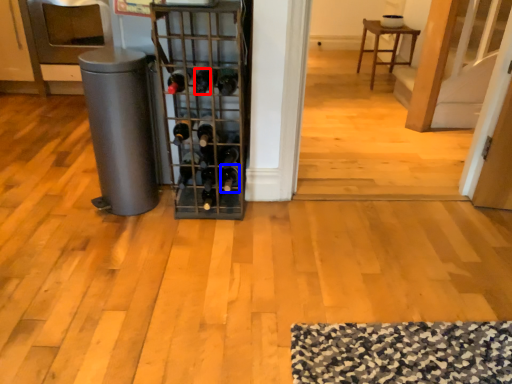
Question: Which object is further to the camera taking this photo, wine bottle (highlighted by a red box) or wine bottle (highlighted by a blue box)?

Choices:
 (A) wine bottle
 (B) wine bottle

Answer: (B)